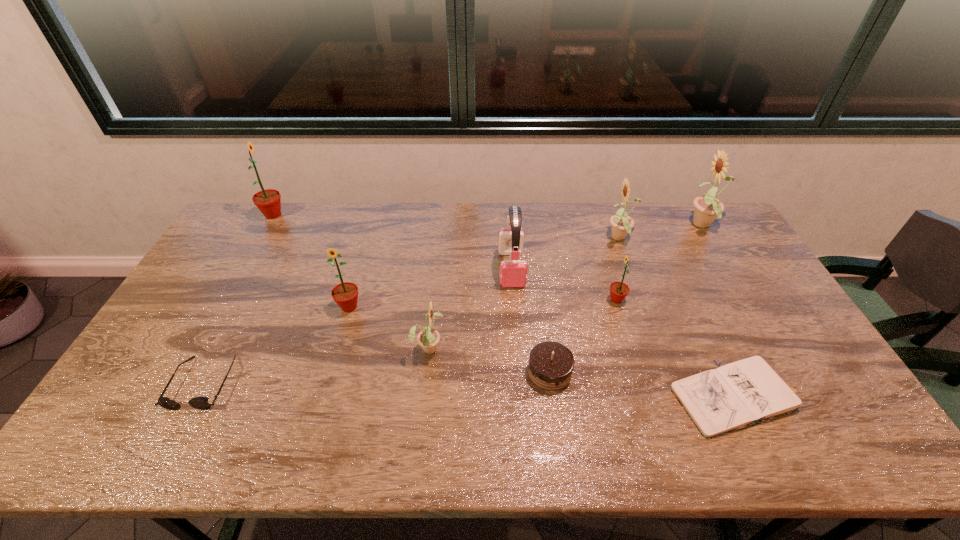
Locate an element on the screen. The height and width of the screenshot is (540, 960). vacant space at the far edge is located at coordinates (451, 218).

You are a GUI agent. You are given a task and a screenshot of the screen. Output one action in this format:
    pyautogui.click(x=<x>, y=<y>)
    Task: Click on the free spot at the near edge of the desktop
    
    Given the screenshot: What is the action you would take?
    pyautogui.click(x=507, y=453)

The height and width of the screenshot is (540, 960). What are the coordinates of `free space at the left edge of the desktop` in the screenshot? It's located at coord(184,363).

In the image, there is a desktop. Identify the location of vacant space at the right edge. (732, 251).

You are a GUI agent. You are given a task and a screenshot of the screen. Output one action in this format:
    pyautogui.click(x=<x>, y=<y>)
    Task: Click on the free space between the nearest sunflower and the seventh nearest object
    This screenshot has height=540, width=960.
    Given the screenshot: What is the action you would take?
    pyautogui.click(x=470, y=308)

At what (x,y) coordinates should I click in order to perform the action: click on unoccupied position between the second yellow sunflower from left to right and the second green sunflower from left to right. Please return your answer as a coordinate pair (x, y). Looking at the image, I should click on (485, 273).

This screenshot has height=540, width=960. I want to click on blank region between the rightmost green sunflower and the eighth object from right to left, so pos(483,303).

The width and height of the screenshot is (960, 540). Find the location of `free spot between the third sunflower from left to right and the sunglasses`. free spot between the third sunflower from left to right and the sunglasses is located at coordinates (316, 365).

Image resolution: width=960 pixels, height=540 pixels. What are the coordinates of `blank region between the eighth object from right to left and the seventh object from right to left` in the screenshot? It's located at (389, 327).

The height and width of the screenshot is (540, 960). Find the location of `empty space that is in between the shortest object and the earphone`. empty space that is in between the shortest object and the earphone is located at coordinates (625, 333).